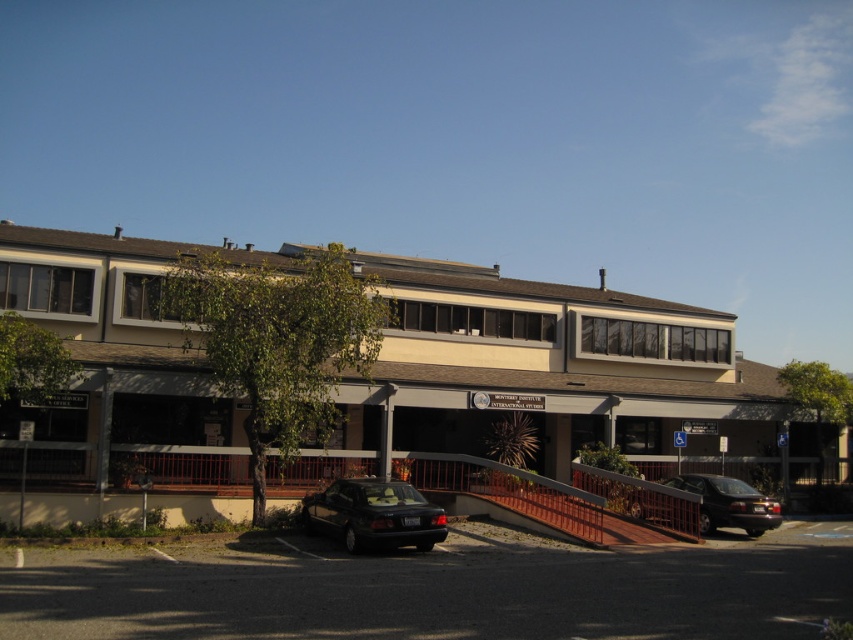
Question: Observing the image, what is the correct spatial positioning of beige/wooden hotel at center in reference to shiny black sedan at lower right?

Choices:
 (A) right
 (B) left

Answer: (B)

Question: Which object is closer to the camera taking this photo?

Choices:
 (A) shiny black sedan at lower right
 (B) beige/wooden hotel at center
 (C) shiny black sedan at lower center

Answer: (C)

Question: Does beige/wooden hotel at center appear under shiny black sedan at lower center?

Choices:
 (A) no
 (B) yes

Answer: (A)

Question: Does beige/wooden hotel at center appear under shiny black sedan at lower center?

Choices:
 (A) no
 (B) yes

Answer: (A)

Question: Which point is farther from the camera taking this photo?

Choices:
 (A) (384, 536)
 (B) (705, 513)

Answer: (B)

Question: Among these points, which one is farthest from the camera?

Choices:
 (A) (726, 477)
 (B) (339, 528)

Answer: (A)